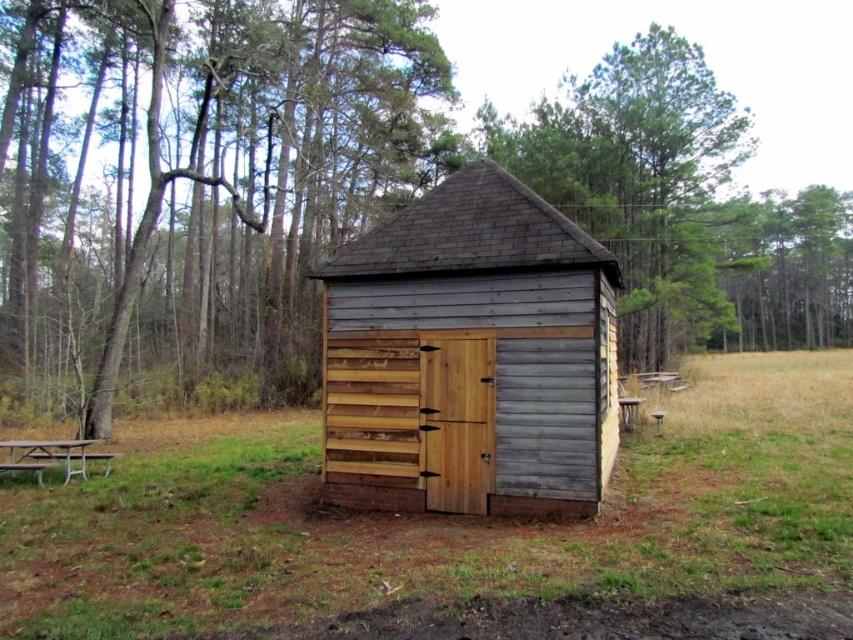
You are standing in front of the shed and notice the brown wood tree at center and the green grass at center. Which object takes up more space in the image?

The brown wood tree at center is larger in size than the green grass at center, so it takes up more space in the image.